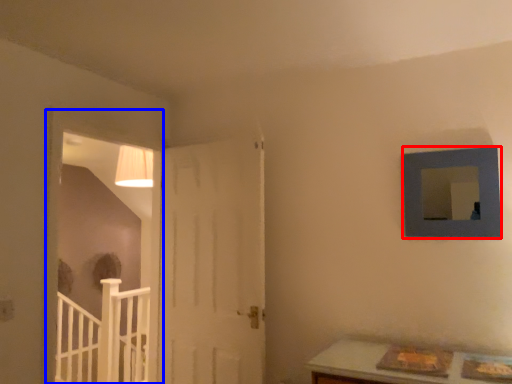
Question: Which object is further to the camera taking this photo, picture frame (highlighted by a red box) or window frame (highlighted by a blue box)?

Choices:
 (A) picture frame
 (B) window frame

Answer: (B)